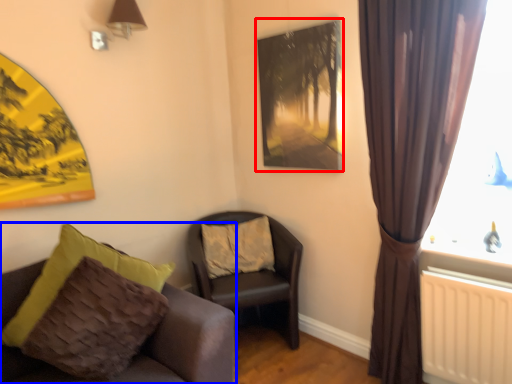
Question: Which object is closer to the camera taking this photo, picture frame (highlighted by a red box) or chair (highlighted by a blue box)?

Choices:
 (A) picture frame
 (B) chair

Answer: (B)